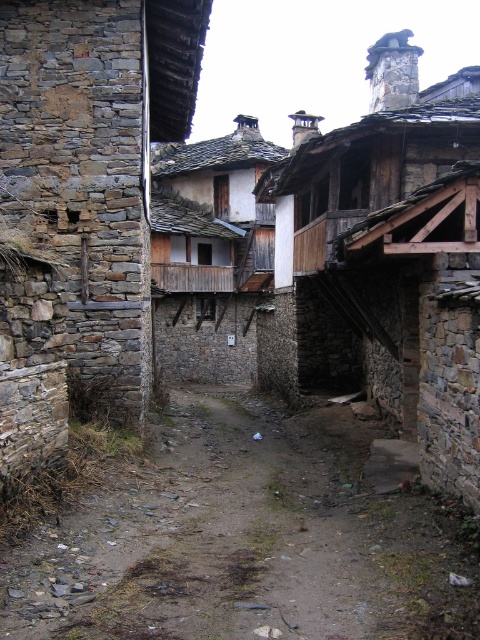
Based on the photo, who is lower down, dirt ground at center or rustic stone hut at left?

Positioned lower is dirt ground at center.

Does point (356, 470) lie in front of point (117, 220)?

Yes, point (356, 470) is closer to viewer.

Who is more distant from viewer, (x=371, y=508) or (x=139, y=49)?

The point (x=139, y=49) is more distant.

Locate an element on the screen. Image resolution: width=480 pixels, height=640 pixels. dirt ground at center is located at coordinates (244, 540).

Is rustic stone hut at left smaller than wooden planks at center?

Correct, rustic stone hut at left occupies less space than wooden planks at center.

Which is behind, point (17, 188) or point (203, 304)?

Point (203, 304)

Which is in front, point (86, 10) or point (217, 266)?

Point (86, 10)

Where is `rustic stone hut at left`? This screenshot has width=480, height=640. rustic stone hut at left is located at coordinates (83, 205).

Which of these two, rustic stone hut at left or wooden balcony at upper right, stands taller?

wooden balcony at upper right is taller.

Looking at this image, measure the distance from rustic stone hut at left to wooden balcony at upper right.

The distance of rustic stone hut at left from wooden balcony at upper right is 4.72 meters.

The image size is (480, 640). What do you see at coordinates (83, 205) in the screenshot?
I see `rustic stone hut at left` at bounding box center [83, 205].

The width and height of the screenshot is (480, 640). Find the location of `rustic stone hut at left`. rustic stone hut at left is located at coordinates (83, 205).